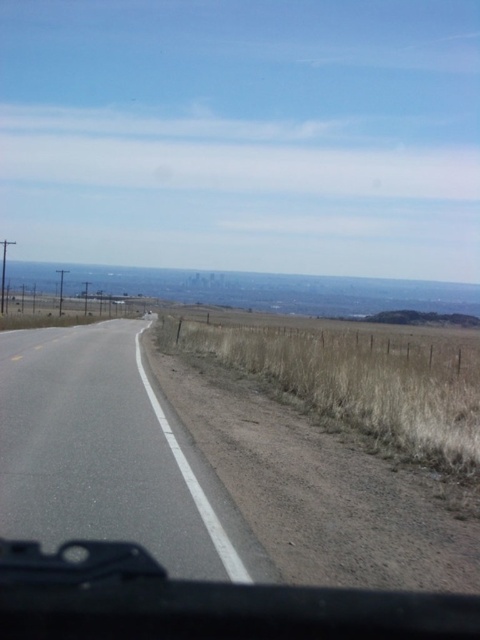
Question: Which point appears closest to the camera in this image?

Choices:
 (A) (118, 284)
 (B) (342, 397)

Answer: (B)

Question: Is asphalt road at center below urban skyline at center?

Choices:
 (A) yes
 (B) no

Answer: (A)

Question: Can you confirm if dry grass at right is positioned above urban skyline at center?

Choices:
 (A) yes
 (B) no

Answer: (B)

Question: Among these objects, which one is farthest from the camera?

Choices:
 (A) dry grass at right
 (B) urban skyline at center
 (C) asphalt road at center

Answer: (B)

Question: Does asphalt road at center lie in front of dry grass at right?

Choices:
 (A) no
 (B) yes

Answer: (B)

Question: Which point is closer to the camera?

Choices:
 (A) (314, 400)
 (B) (204, 296)
 (C) (108, 448)

Answer: (C)